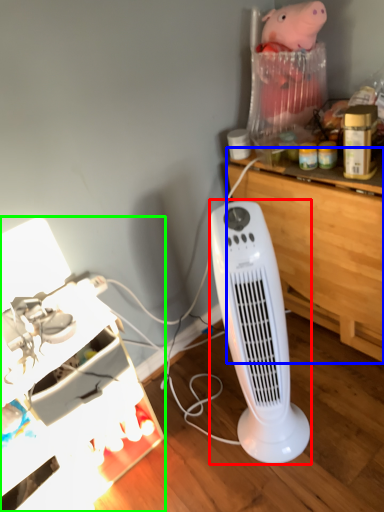
Question: Considering the real-world distances, which object is farthest from home appliance (highlighted by a red box)? computer desk (highlighted by a blue box) or furniture (highlighted by a green box)?

Choices:
 (A) computer desk
 (B) furniture

Answer: (B)